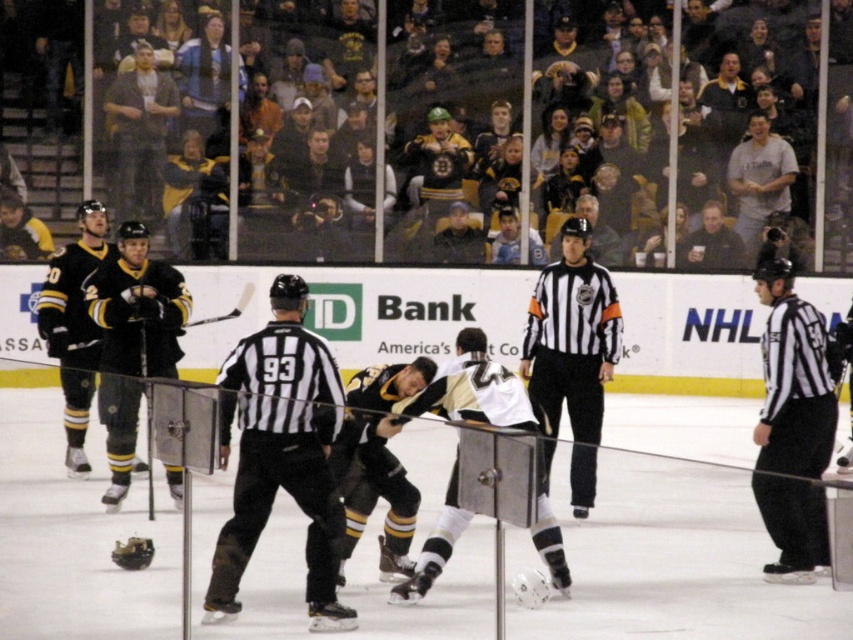
Is black and white striped shirt at center wider than gray cotton shirt at upper right?

No.

Which of these two, black and white striped shirt at center or gray cotton shirt at upper right, stands taller?

black and white striped shirt at center is taller.

Who is more distant from viewer, (555, 387) or (750, 243)?

Positioned behind is point (750, 243).

At what (x,y) coordinates should I click in order to perform the action: click on black and white striped shirt at center. Please return your answer as a coordinate pair (x, y). The width and height of the screenshot is (853, 640). Looking at the image, I should click on (572, 353).

Who is positioned more to the left, matte black hockey stick at left or black matte hockey stick at left?

Positioned to the left is matte black hockey stick at left.

Is matte black hockey stick at left to the left of black matte hockey stick at left from the viewer's perspective?

Yes, matte black hockey stick at left is to the left of black matte hockey stick at left.

This screenshot has height=640, width=853. Describe the element at coordinates (132, 340) in the screenshot. I see `matte black hockey stick at left` at that location.

Identify the location of matte black hockey stick at left. This screenshot has height=640, width=853. (132, 340).

Between matte black hockey stick at left and black jersey at center, which one has less height?

With less height is black jersey at center.

Is point (144, 308) positioned in front of point (410, 381)?

No.

Where is `matte black hockey stick at left`? matte black hockey stick at left is located at coordinates (132, 340).